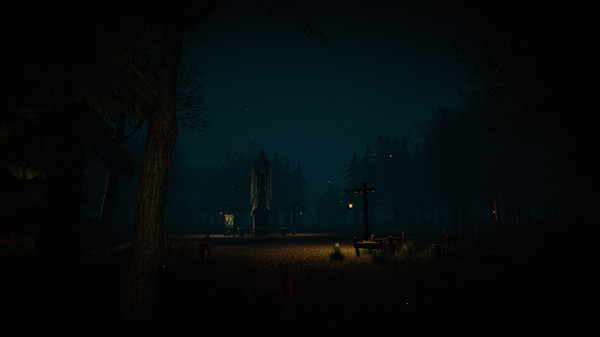
Where is `statue base`? This screenshot has width=600, height=337. statue base is located at coordinates (264, 222).